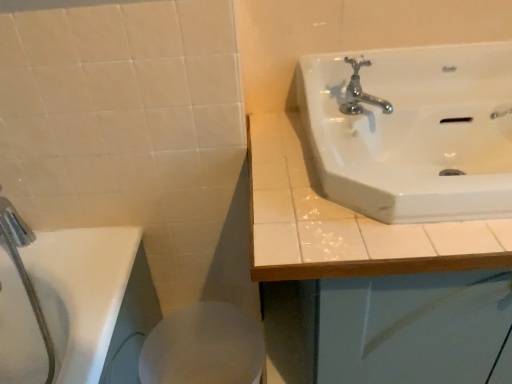
Identify the location of vacant space to the left of chrome metallic faucet at upper right. [x=279, y=132].